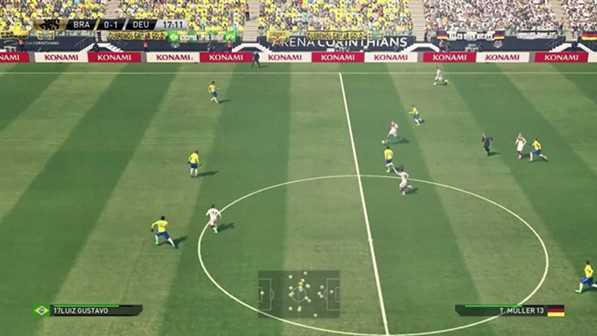
Locate an element on the screen. stands is located at coordinates click(304, 11), click(476, 14), click(201, 11), click(38, 13).